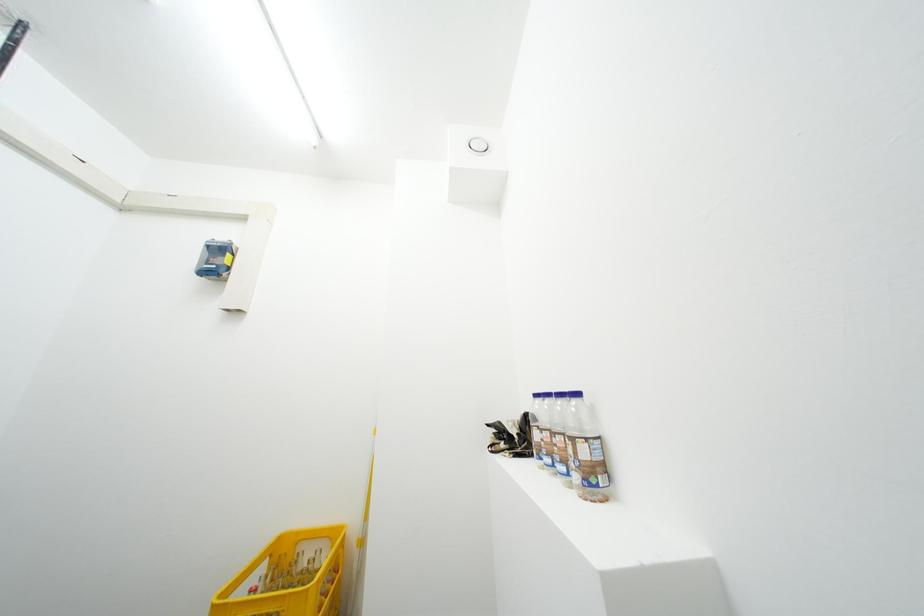
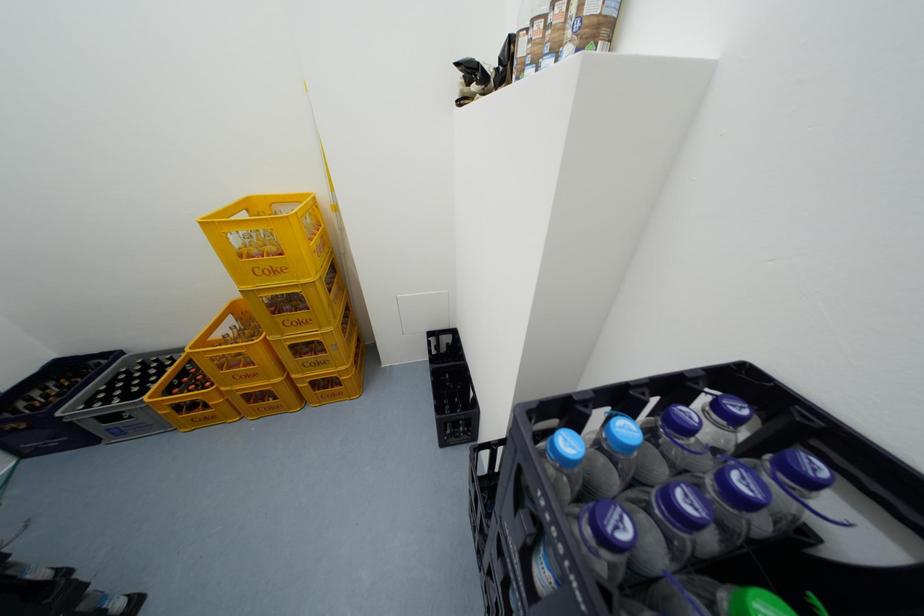
Question: How did the camera likely rotate?

Choices:
 (A) Left
 (B) Right
 (C) Up
 (D) Down

Answer: (D)